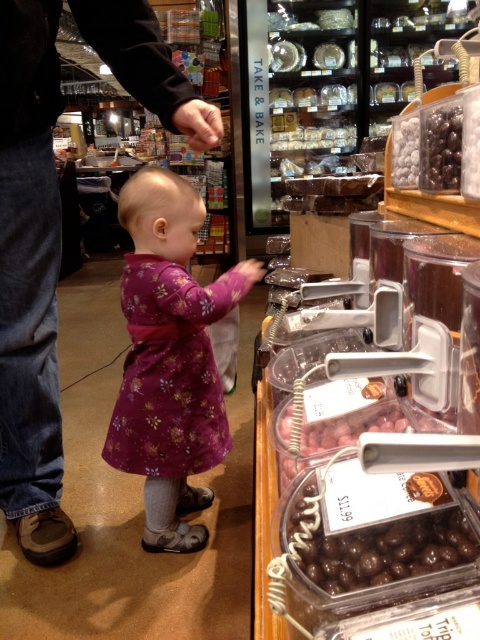
Question: Which object appears closest to the camera in this image?

Choices:
 (A) purple floral dress at center
 (B) shiny chocolate candy at right

Answer: (B)

Question: Is shiny chocolate candy at upper right above chocolate-coated nuts at upper right?

Choices:
 (A) yes
 (B) no

Answer: (B)

Question: Considering the relative positions of shiny chocolate balls at lower right and shiny chocolate candy at right in the image provided, where is shiny chocolate balls at lower right located with respect to shiny chocolate candy at right?

Choices:
 (A) above
 (B) below

Answer: (B)

Question: Does shiny chocolate balls at lower right appear under shiny chocolate candy at upper right?

Choices:
 (A) no
 (B) yes

Answer: (B)

Question: Which point is farther from the camera taking this photo?

Choices:
 (A) (479, 161)
 (B) (404, 136)
 (C) (324, 563)

Answer: (B)

Question: Which object is the farthest from the chocolate-coated nuts at upper right?

Choices:
 (A) shiny chocolate balls at lower right
 (B) purple floral dress at center
 (C) shiny chocolate candy at upper right
 (D) shiny chocolate candy at right

Answer: (A)